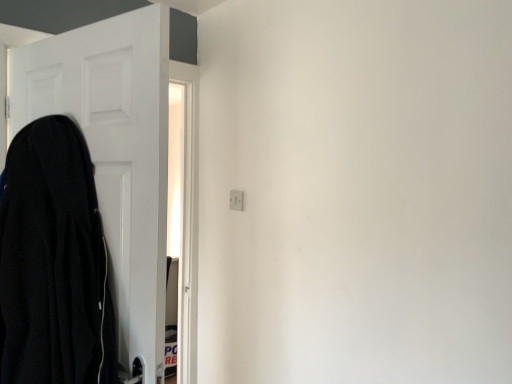
Question: From the image's perspective, is white matte door at left located beneath white plastic electric outlet at upper center?

Choices:
 (A) no
 (B) yes

Answer: (B)

Question: Is white plastic electric outlet at upper center located within white matte door at left?

Choices:
 (A) yes
 (B) no

Answer: (B)

Question: Considering the relative sizes of white matte door at left and white plastic electric outlet at upper center in the image provided, is white matte door at left thinner than white plastic electric outlet at upper center?

Choices:
 (A) yes
 (B) no

Answer: (B)

Question: Is white matte door at left positioned with its back to white plastic electric outlet at upper center?

Choices:
 (A) yes
 (B) no

Answer: (A)

Question: Does white matte door at left appear on the right side of white plastic electric outlet at upper center?

Choices:
 (A) no
 (B) yes

Answer: (A)

Question: Is white matte door at left aimed at white plastic electric outlet at upper center?

Choices:
 (A) yes
 (B) no

Answer: (A)

Question: Does black matte coat at left touch white matte door at left?

Choices:
 (A) yes
 (B) no

Answer: (B)

Question: From a real-world perspective, is black matte coat at left over white matte door at left?

Choices:
 (A) yes
 (B) no

Answer: (B)

Question: Is white matte door at left inside black matte coat at left?

Choices:
 (A) yes
 (B) no

Answer: (B)

Question: Is black matte coat at left closer to the viewer compared to white matte door at left?

Choices:
 (A) yes
 (B) no

Answer: (A)

Question: Is black matte coat at left to the left of white matte door at left from the viewer's perspective?

Choices:
 (A) no
 (B) yes

Answer: (B)

Question: Could you tell me if black matte coat at left is facing white matte door at left?

Choices:
 (A) yes
 (B) no

Answer: (A)

Question: Would you say white matte door at left is outside black matte coat at left?

Choices:
 (A) yes
 (B) no

Answer: (A)